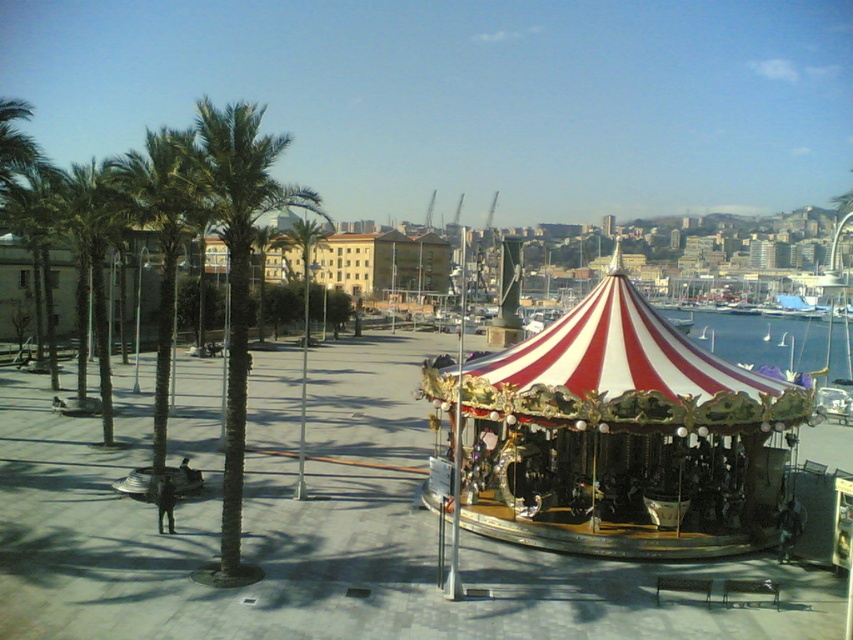
Is green leafy palm tree at left smaller than blue water at center?

Correct, green leafy palm tree at left occupies less space than blue water at center.

Which of these two, green leafy palm tree at left or blue water at center, stands shorter?

With less height is blue water at center.

Who is more distant from viewer, [161,451] or [724,324]?

The point [724,324] is behind.

The image size is (853, 640). Find the location of `green leafy palm tree at left`. green leafy palm tree at left is located at coordinates (161, 275).

Is the position of red and white striped carousel at center less distant than that of green textured palm tree at left?

That is True.

Can you confirm if red and white striped carousel at center is positioned above green textured palm tree at left?

No, red and white striped carousel at center is not above green textured palm tree at left.

Which is behind, point (465, 504) or point (239, 426)?

The point (465, 504) is behind.

You are a GUI agent. You are given a task and a screenshot of the screen. Output one action in this format:
    pyautogui.click(x=<x>, y=<y>)
    Task: Click on the red and white striped carousel at center
    Image resolution: width=853 pixels, height=640 pixels.
    Given the screenshot: What is the action you would take?
    pyautogui.click(x=611, y=436)

Can you confirm if green textured palm tree at left is positioned to the right of green leafy palm tree at left?

Incorrect, green textured palm tree at left is not on the right side of green leafy palm tree at left.

Which is in front, point (254, 566) or point (132, 486)?

Point (254, 566) is in front.

Identify the location of green textured palm tree at left. (236, 280).